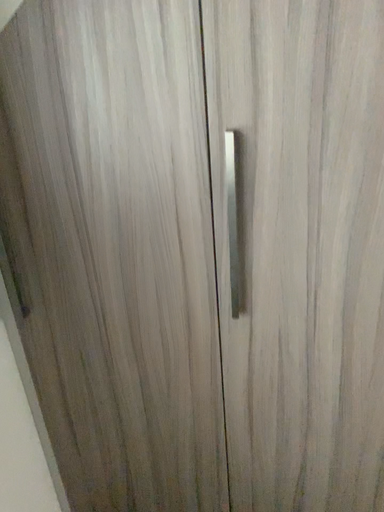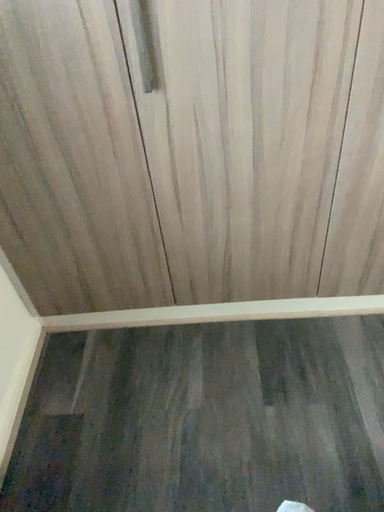
Question: Which way did the camera rotate in the video?

Choices:
 (A) rotated upward
 (B) rotated downward

Answer: (B)